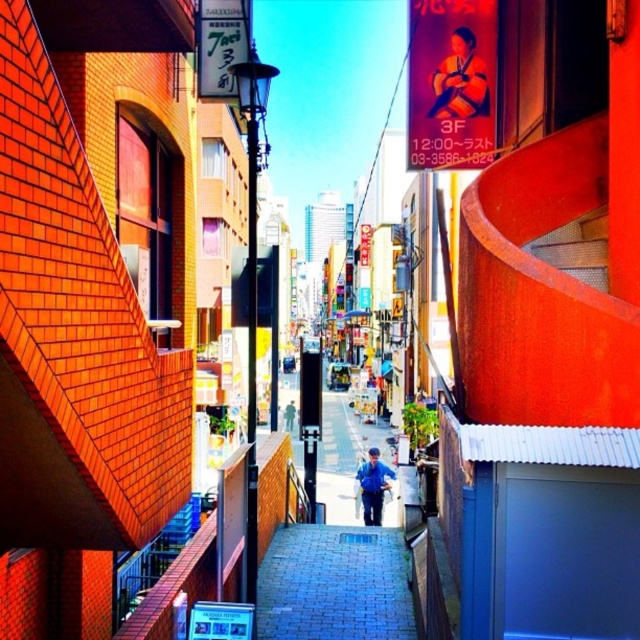
Question: Considering the real-world distances, which object is farthest from the blue fabric jacket at center?

Choices:
 (A) blue brick pavement at center
 (B) silky kimono at center

Answer: (B)

Question: Does blue brick pavement at center have a lesser width compared to blue fabric jacket at center?

Choices:
 (A) no
 (B) yes

Answer: (A)

Question: Where is blue brick pavement at center located in relation to silky kimono at center in the image?

Choices:
 (A) left
 (B) right

Answer: (A)

Question: Which point is closer to the camera taking this photo?

Choices:
 (A) (262, 611)
 (B) (380, 509)
 (C) (476, 83)

Answer: (A)

Question: Which point appears closest to the camera in this image?

Choices:
 (A) (369, 522)
 (B) (330, 548)

Answer: (B)

Question: Is blue brick pavement at center wider than silky kimono at center?

Choices:
 (A) yes
 (B) no

Answer: (A)